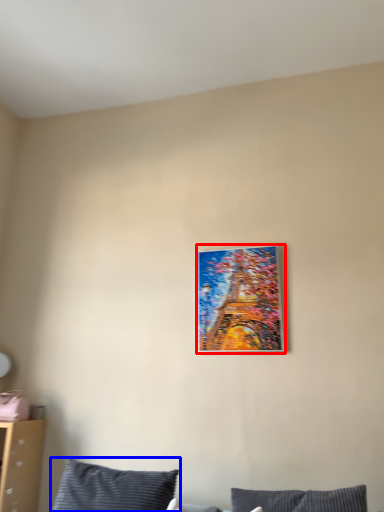
Question: Among these objects, which one is farthest to the camera, picture frame (highlighted by a red box) or pillow (highlighted by a blue box)?

Choices:
 (A) picture frame
 (B) pillow

Answer: (A)